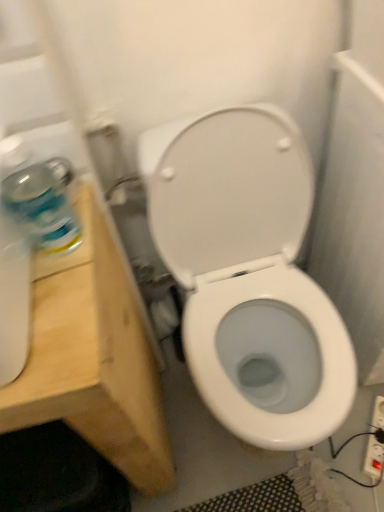
Question: Is light wood vanity at left beside white plastic electrical outlet at lower right?

Choices:
 (A) no
 (B) yes

Answer: (A)

Question: Is white plastic electrical outlet at lower right at the back of light wood vanity at left?

Choices:
 (A) no
 (B) yes

Answer: (A)

Question: Considering the relative positions of light wood vanity at left and white plastic electrical outlet at lower right in the image provided, is light wood vanity at left to the left of white plastic electrical outlet at lower right from the viewer's perspective?

Choices:
 (A) yes
 (B) no

Answer: (A)

Question: Is light wood vanity at left bigger than white plastic electrical outlet at lower right?

Choices:
 (A) yes
 (B) no

Answer: (A)

Question: Is light wood vanity at left to the right of white plastic electrical outlet at lower right from the viewer's perspective?

Choices:
 (A) no
 (B) yes

Answer: (A)

Question: Is light wood vanity at left not inside white plastic electrical outlet at lower right?

Choices:
 (A) yes
 (B) no

Answer: (A)

Question: Is light wood vanity at left oriented towards white glossy toilet at center?

Choices:
 (A) yes
 (B) no

Answer: (B)

Question: Does light wood vanity at left have a greater height compared to white glossy toilet at center?

Choices:
 (A) yes
 (B) no

Answer: (A)

Question: Is light wood vanity at left far from white glossy toilet at center?

Choices:
 (A) no
 (B) yes

Answer: (A)

Question: From a real-world perspective, is light wood vanity at left below white glossy toilet at center?

Choices:
 (A) no
 (B) yes

Answer: (A)

Question: Does light wood vanity at left have a greater width compared to white glossy toilet at center?

Choices:
 (A) no
 (B) yes

Answer: (A)

Question: Can you confirm if light wood vanity at left is smaller than white glossy toilet at center?

Choices:
 (A) no
 (B) yes

Answer: (A)

Question: Is white glossy toilet at center turned away from light wood vanity at left?

Choices:
 (A) yes
 (B) no

Answer: (B)